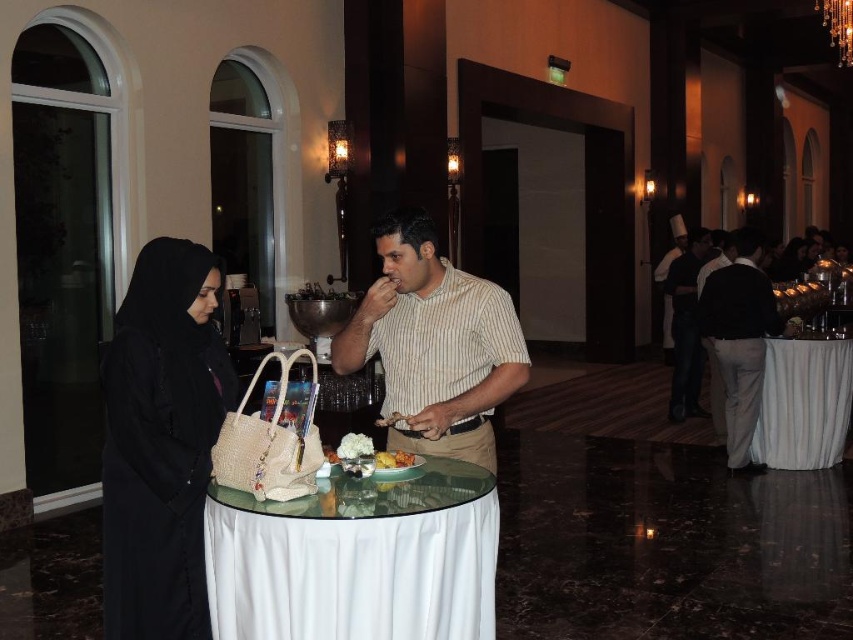
Does point (476, 557) come closer to viewer compared to point (762, 310)?

Yes.

Who is shorter, white cloth-covered table at center or black fabric dress at center?

white cloth-covered table at center is shorter.

Does point (463, 518) come behind point (735, 371)?

No, (463, 518) is closer to viewer.

Find the location of a particular element. The height and width of the screenshot is (640, 853). white cloth-covered table at center is located at coordinates (357, 557).

Which is more to the left, white cloth-covered table at center or black woven abaya at left?

Positioned to the left is black woven abaya at left.

Can you confirm if white cloth-covered table at center is positioned above black woven abaya at left?

Actually, white cloth-covered table at center is below black woven abaya at left.

The image size is (853, 640). Describe the element at coordinates (357, 557) in the screenshot. I see `white cloth-covered table at center` at that location.

The height and width of the screenshot is (640, 853). I want to click on white cloth-covered table at center, so click(x=357, y=557).

Between striped cotton shirt at center and white glossy plate at center, which one appears on the right side from the viewer's perspective?

striped cotton shirt at center is more to the right.

Does striped cotton shirt at center appear under white glossy plate at center?

No, striped cotton shirt at center is not below white glossy plate at center.

This screenshot has width=853, height=640. I want to click on striped cotton shirt at center, so click(x=434, y=346).